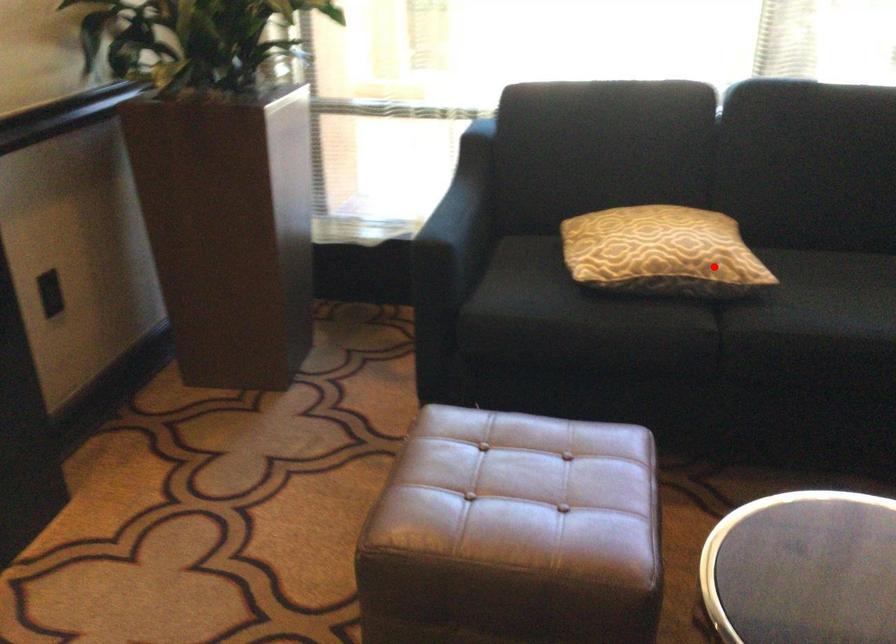
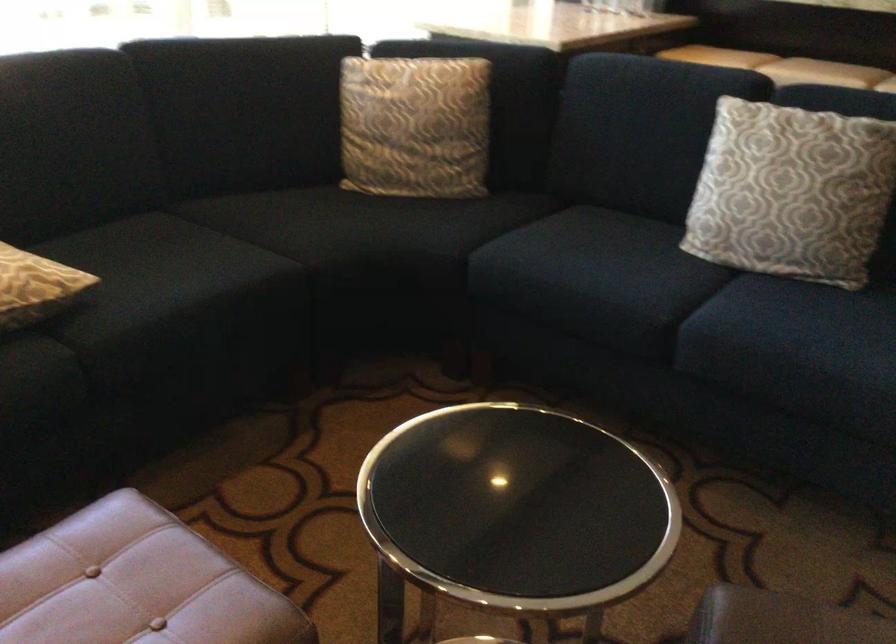
Question: I am providing you with two images of the same scene from different viewpoints. Image1 has a red point marked. In image2, the corresponding 3D location appears at what relative position? Reply with the corresponding letter.

Choices:
 (A) Closer
 (B) Farther

Answer: (A)